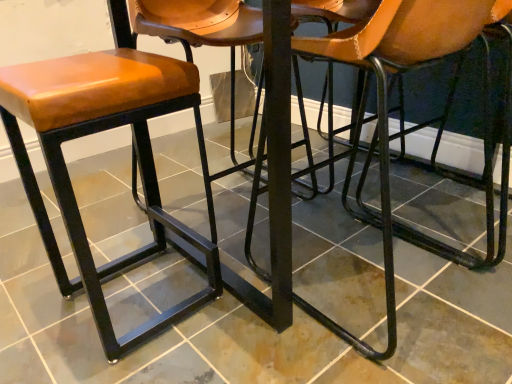
The height and width of the screenshot is (384, 512). I want to click on free space below matte brown leather stool at left (from a real-world perspective), so click(x=130, y=301).